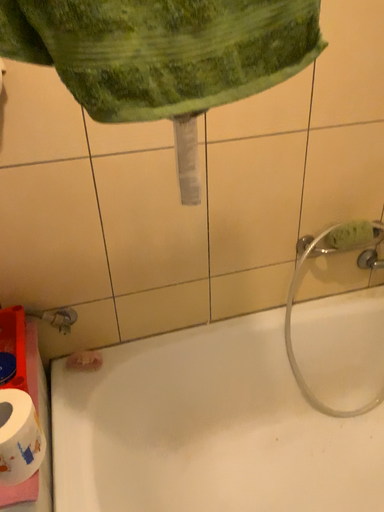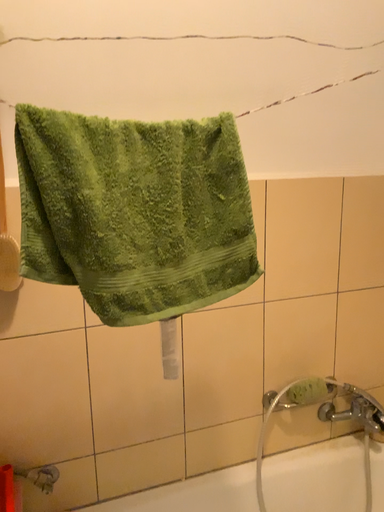
Question: How did the camera likely rotate when shooting the video?

Choices:
 (A) rotated downward
 (B) rotated upward

Answer: (B)